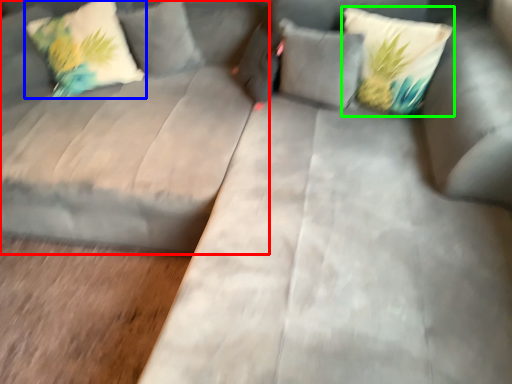
Question: Which object is positioned closest to couch (highlighted by a red box)? Select from pillow (highlighted by a blue box) and pillow (highlighted by a green box).

Choices:
 (A) pillow
 (B) pillow

Answer: (A)